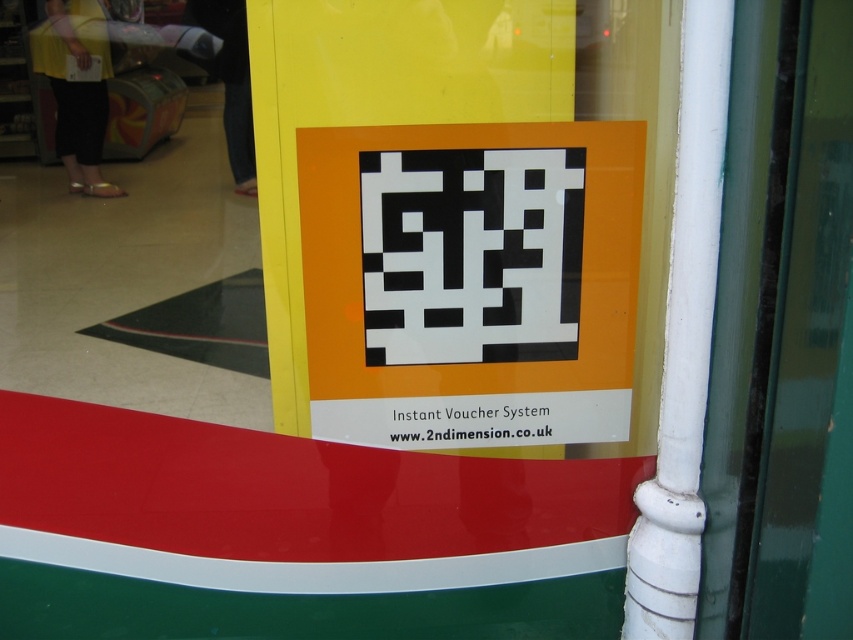
You are a customer standing in front of the window display. You see the black paper qr code at center and the black pixelated qr code at center. Which one is bigger?

The black paper qr code at center is larger in size than the black pixelated qr code at center.